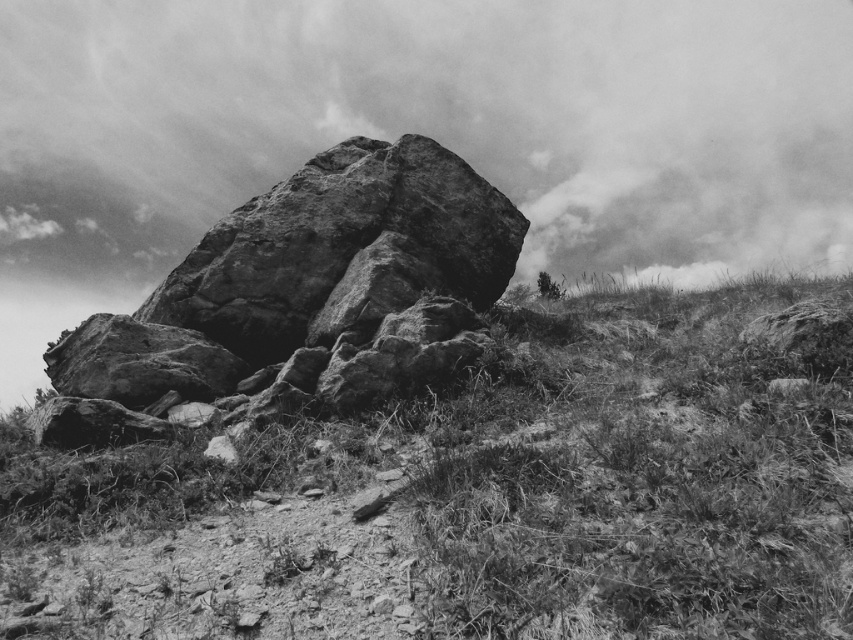
Is cloudy sky at upper center shorter than rough textured rock at center?

In fact, cloudy sky at upper center may be taller than rough textured rock at center.

Does cloudy sky at upper center have a lesser width compared to rough textured rock at center?

In fact, cloudy sky at upper center might be wider than rough textured rock at center.

Image resolution: width=853 pixels, height=640 pixels. I want to click on cloudy sky at upper center, so click(431, 124).

Locate an element on the screen. The image size is (853, 640). cloudy sky at upper center is located at coordinates (431, 124).

Can you confirm if fuzzy green grass at center is positioned to the right of cloudy sky at upper center?

Yes, fuzzy green grass at center is to the right of cloudy sky at upper center.

Can you confirm if fuzzy green grass at center is positioned above cloudy sky at upper center?

No, fuzzy green grass at center is not above cloudy sky at upper center.

Describe the element at coordinates (480, 499) in the screenshot. This screenshot has width=853, height=640. I see `fuzzy green grass at center` at that location.

This screenshot has height=640, width=853. Identify the location of fuzzy green grass at center. (480, 499).

Is point (693, 294) behind point (526, 230)?

Yes, it is behind point (526, 230).

Between fuzzy green grass at center and rough textured rock at center, which one appears on the left side from the viewer's perspective?

rough textured rock at center is more to the left.

Does point (74, 620) come behind point (334, 148)?

No, (74, 620) is closer to viewer.

You are a GUI agent. You are given a task and a screenshot of the screen. Output one action in this format:
    pyautogui.click(x=<x>, y=<y>)
    Task: Click on the fuzzy green grass at center
    The height and width of the screenshot is (640, 853).
    Given the screenshot: What is the action you would take?
    pyautogui.click(x=480, y=499)